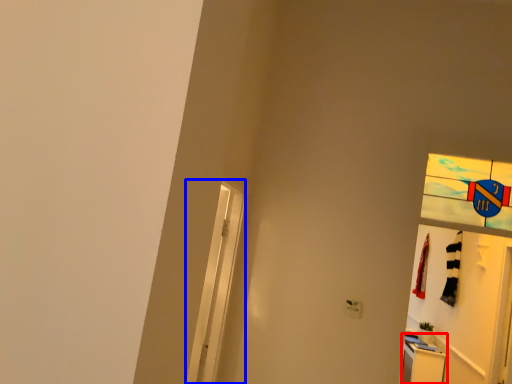
Question: Among these objects, which one is nearest to the camera, dresser (highlighted by a red box) or screen door (highlighted by a blue box)?

Choices:
 (A) dresser
 (B) screen door

Answer: (B)